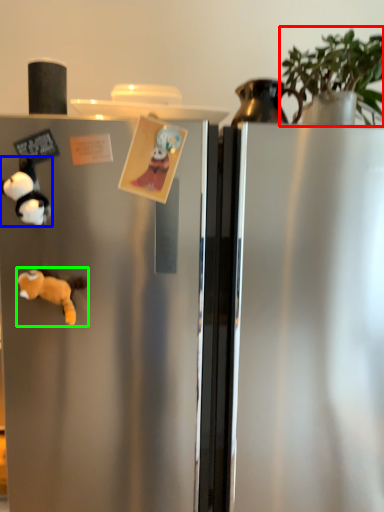
Question: Which object is positioned farthest from plant (highlighted by a red box)? Select from toy (highlighted by a blue box) and animal (highlighted by a green box).

Choices:
 (A) toy
 (B) animal

Answer: (B)